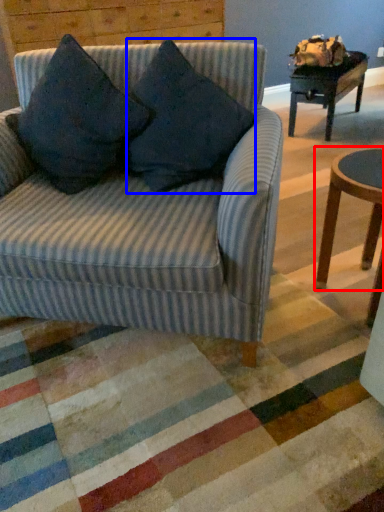
Question: Which point is closer to the camera, coffee table (highlighted by a red box) or throw pillow (highlighted by a blue box)?

Choices:
 (A) coffee table
 (B) throw pillow

Answer: (B)